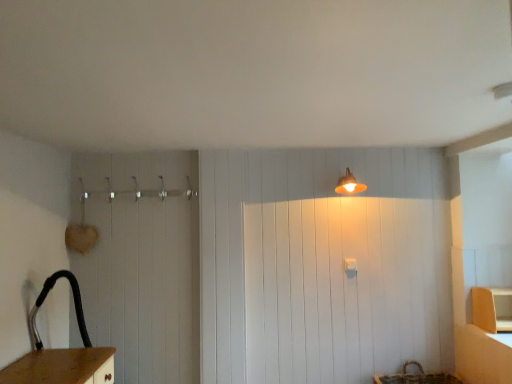
The image size is (512, 384). What do you see at coordinates (492, 309) in the screenshot? I see `matte wood cabinet at lower right` at bounding box center [492, 309].

I want to click on matte wood cabinet at lower right, so click(492, 309).

At what (x,y) coordinates should I click in order to perform the action: click on matte orange lampshade at upper center. Please return your answer as a coordinate pair (x, y). The height and width of the screenshot is (384, 512). Looking at the image, I should click on (349, 184).

What do you see at coordinates (349, 184) in the screenshot? The width and height of the screenshot is (512, 384). I see `matte orange lampshade at upper center` at bounding box center [349, 184].

The height and width of the screenshot is (384, 512). I want to click on matte wood cabinet at lower right, so click(x=492, y=309).

Considering the relative positions of matte wood cabinet at lower right and matte orange lampshade at upper center in the image provided, is matte wood cabinet at lower right to the right of matte orange lampshade at upper center from the viewer's perspective?

Yes.

Considering the relative positions of matte wood cabinet at lower right and matte orange lampshade at upper center in the image provided, is matte wood cabinet at lower right in front of matte orange lampshade at upper center?

Yes.

Is point (473, 305) positioned in front of point (347, 178)?

Yes, it is.

From the image's perspective, which one is positioned lower, matte wood cabinet at lower right or matte orange lampshade at upper center?

matte wood cabinet at lower right, from the image's perspective.

From a real-world perspective, which is physically below, matte wood cabinet at lower right or matte orange lampshade at upper center?

matte wood cabinet at lower right, from a real-world perspective.

In terms of width, does matte wood cabinet at lower right look wider or thinner when compared to matte orange lampshade at upper center?

Considering their sizes, matte wood cabinet at lower right looks broader than matte orange lampshade at upper center.

Who is shorter, matte wood cabinet at lower right or matte orange lampshade at upper center?

With less height is matte orange lampshade at upper center.

Between matte wood cabinet at lower right and matte orange lampshade at upper center, which one has smaller size?

With smaller size is matte orange lampshade at upper center.

Can we say matte wood cabinet at lower right lies outside matte orange lampshade at upper center?

Indeed, matte wood cabinet at lower right is completely outside matte orange lampshade at upper center.

Are matte wood cabinet at lower right and matte orange lampshade at upper center beside each other?

No.

Is matte wood cabinet at lower right looking in the opposite direction of matte orange lampshade at upper center?

matte wood cabinet at lower right is not turned away from matte orange lampshade at upper center.

From the picture: How different are the orientations of matte wood cabinet at lower right and matte orange lampshade at upper center in degrees?

The angular difference between matte wood cabinet at lower right and matte orange lampshade at upper center is 11.9 degrees.

Find the location of a particular element. The height and width of the screenshot is (384, 512). cabinetry that is under the matte orange lampshade at upper center (from a real-world perspective) is located at coordinates point(492,309).

In the scene shown: Based on their positions, is matte orange lampshade at upper center located to the left or right of matte wood cabinet at lower right?

matte orange lampshade at upper center is positioned on matte wood cabinet at lower right's left side.

Is matte orange lampshade at upper center behind matte wood cabinet at lower right?

Yes, matte orange lampshade at upper center is further from the camera.

Is point (337, 191) positioned before point (509, 294)?

No, (337, 191) is behind (509, 294).

From the image's perspective, would you say matte orange lampshade at upper center is positioned over matte wood cabinet at lower right?

Yes, from the image's perspective, matte orange lampshade at upper center is above matte wood cabinet at lower right.

From a real-world perspective, is matte orange lampshade at upper center physically located above or below matte wood cabinet at lower right?

From a real-world perspective, matte orange lampshade at upper center is physically above matte wood cabinet at lower right.

Which of these two, matte orange lampshade at upper center or matte wood cabinet at lower right, is thinner?

With smaller width is matte orange lampshade at upper center.

Can you confirm if matte orange lampshade at upper center is shorter than matte wood cabinet at lower right?

Yes.

Which of these two, matte orange lampshade at upper center or matte wood cabinet at lower right, is bigger?

matte wood cabinet at lower right is bigger.

Would you say matte orange lampshade at upper center is outside matte wood cabinet at lower right?

That's correct, matte orange lampshade at upper center is outside of matte wood cabinet at lower right.

Are matte orange lampshade at upper center and matte wood cabinet at lower right far apart?

Absolutely, matte orange lampshade at upper center is distant from matte wood cabinet at lower right.

Could you tell me if matte orange lampshade at upper center is facing matte wood cabinet at lower right?

No, matte orange lampshade at upper center is not turned towards matte wood cabinet at lower right.

What's the angular difference between matte orange lampshade at upper center and matte wood cabinet at lower right's facing directions?

matte orange lampshade at upper center and matte wood cabinet at lower right are facing 11.9 degrees away from each other.

The image size is (512, 384). In the image, there is a matte orange lampshade at upper center. Find the location of `cabinetry below it (from the image's perspective)`. cabinetry below it (from the image's perspective) is located at coordinates (492, 309).

Locate an element on the screen. This screenshot has height=384, width=512. cabinetry on the right side of matte orange lampshade at upper center is located at coordinates (492, 309).

The width and height of the screenshot is (512, 384). I want to click on light fixture that is on the left side of matte wood cabinet at lower right, so click(x=349, y=184).